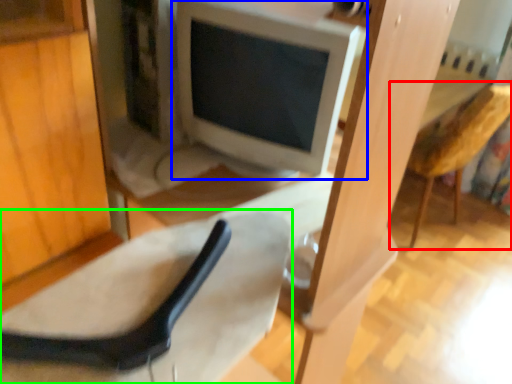
Question: Which object is the farthest from armchair (highlighted by a red box)? Choose among these: computer monitor (highlighted by a blue box) or chair (highlighted by a green box).

Choices:
 (A) computer monitor
 (B) chair

Answer: (B)